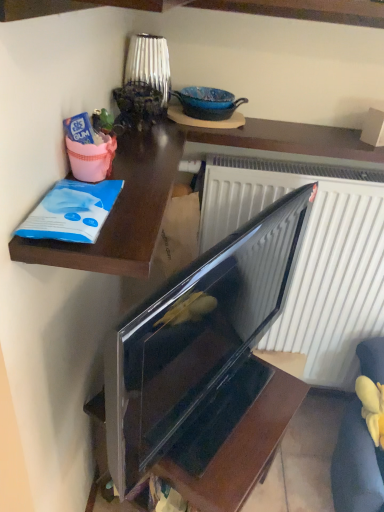
Identify the location of velvet yellow armchair at lower right. (357, 466).

The height and width of the screenshot is (512, 384). What do you see at coordinates (204, 365) in the screenshot?
I see `glossy black tv at center` at bounding box center [204, 365].

Measure the distance between point (201, 93) and camera.

Point (201, 93) and camera are 3.85 feet apart from each other.

Where is `glossy black tv at lower right`? glossy black tv at lower right is located at coordinates (242, 449).

Measure the distance between point (x=102, y=438) and camera.

Point (x=102, y=438) and camera are 1.40 meters apart from each other.

In order to click on velvet yellow armchair at lower right in this screenshot , I will do `click(357, 466)`.

Looking at this image, is blue plastic bag at upper left inside or outside of glossy black tv at center?

blue plastic bag at upper left is spatially situated outside glossy black tv at center.

Considering their positions, is blue plastic bag at upper left located in front of or behind glossy black tv at center?

In the image, blue plastic bag at upper left appears behind glossy black tv at center.

Which object is wider, blue plastic bag at upper left or glossy black tv at center?

blue plastic bag at upper left.

Is the surface of blue plastic bag at upper left in direct contact with glossy black tv at center?

No, blue plastic bag at upper left is not next to glossy black tv at center.

From the picture: Looking at their sizes, would you say glossy black tv at center is wider or thinner than blue plastic bag at upper left?

Considering their sizes, glossy black tv at center looks slimmer than blue plastic bag at upper left.

From the image's perspective, between glossy black tv at center and blue plastic bag at upper left, which one is located above?

From the image's view, blue plastic bag at upper left is above.

Are glossy black tv at center and blue plastic bag at upper left making contact?

They are not placed beside each other.

From a real-world perspective, is glossy black tv at center positioned above or below blue plastic bag at upper left?

glossy black tv at center is situated lower than blue plastic bag at upper left in the real world.

From the image's perspective, which is below, glossy black tv at lower right or blue plastic bag at upper left?

glossy black tv at lower right, from the image's perspective.

Which is less distant, (250, 469) or (51, 242)?

Point (250, 469) appears to be farther away from the viewer than point (51, 242).

Is glossy black tv at lower right inside the boundaries of blue plastic bag at upper left, or outside?

glossy black tv at lower right is located beyond the bounds of blue plastic bag at upper left.

Looking at this image, is glossy black tv at center at the back of glossy black tv at lower right?

No, glossy black tv at lower right's orientation is not away from glossy black tv at center.

Considering the relative positions of glossy black tv at lower right and glossy black tv at center in the image provided, is glossy black tv at lower right in front of glossy black tv at center?

No, glossy black tv at lower right is further to the viewer.

Can you confirm if glossy black tv at lower right is shorter than glossy black tv at center?

Yes, glossy black tv at lower right is shorter than glossy black tv at center.

Between velvet yellow armchair at lower right and shiny blue ceramic bowl at upper center, which one is positioned behind?

shiny blue ceramic bowl at upper center is behind.

From a real-world perspective, which object rests below the other?

From a 3D spatial view, velvet yellow armchair at lower right is below.

Is there a large distance between velvet yellow armchair at lower right and shiny blue ceramic bowl at upper center?

velvet yellow armchair at lower right is positioned a significant distance from shiny blue ceramic bowl at upper center.

Is velvet yellow armchair at lower right shorter than shiny blue ceramic bowl at upper center?

In fact, velvet yellow armchair at lower right may be taller than shiny blue ceramic bowl at upper center.

Is velvet yellow armchair at lower right inside the boundaries of blue plastic bag at upper left, or outside?

velvet yellow armchair at lower right lies outside blue plastic bag at upper left.

From a real-world perspective, who is located lower, velvet yellow armchair at lower right or blue plastic bag at upper left?

From a 3D spatial view, velvet yellow armchair at lower right is below.

Does velvet yellow armchair at lower right have a greater height compared to blue plastic bag at upper left?

Indeed, velvet yellow armchair at lower right has a greater height compared to blue plastic bag at upper left.

Can you confirm if velvet yellow armchair at lower right is thinner than blue plastic bag at upper left?

Correct, the width of velvet yellow armchair at lower right is less than that of blue plastic bag at upper left.

From a real-world perspective, relative to velvet yellow armchair at lower right, is shiny blue ceramic bowl at upper center vertically above or below?

shiny blue ceramic bowl at upper center is above velvet yellow armchair at lower right.

From the picture: Can you tell me how much shiny blue ceramic bowl at upper center and velvet yellow armchair at lower right differ in facing direction?

2.82 degrees.

Is shiny blue ceramic bowl at upper center aimed at velvet yellow armchair at lower right?

No.

Is point (195, 109) farther from camera compared to point (339, 488)?

No, it is not.

Locate an element on the screen. television beneath the blue plastic bag at upper left (from a real-world perspective) is located at coordinates click(x=204, y=365).

The height and width of the screenshot is (512, 384). Find the location of `desk lying behind the glossy black tv at center`. desk lying behind the glossy black tv at center is located at coordinates (121, 210).

When comparing their distances from velvet yellow armchair at lower right, does glossy black tv at lower right or shiny blue ceramic bowl at upper center seem closer?

glossy black tv at lower right is positioned closer to the anchor velvet yellow armchair at lower right.

Estimate the real-world distances between objects in this image. Which object is closer to glossy black tv at lower right, glossy black tv at center or velvet yellow armchair at lower right?

glossy black tv at center lies closer to glossy black tv at lower right than the other object.

When comparing their distances from shiny blue ceramic bowl at upper center, does glossy black tv at center or blue plastic bag at upper left seem further?

The object further to shiny blue ceramic bowl at upper center is glossy black tv at center.

When comparing their distances from glossy black tv at center, does velvet yellow armchair at lower right or shiny blue ceramic bowl at upper center seem further?

shiny blue ceramic bowl at upper center lies further to glossy black tv at center than the other object.

Looking at the image, which one is located closer to glossy black tv at center, shiny blue ceramic bowl at upper center or velvet yellow armchair at lower right?

The object closer to glossy black tv at center is velvet yellow armchair at lower right.

Estimate the real-world distances between objects in this image. Which object is closer to velvet yellow armchair at lower right, glossy black tv at lower right or blue plastic bag at upper left?

glossy black tv at lower right is closer to velvet yellow armchair at lower right.

Based on their spatial positions, is shiny blue ceramic bowl at upper center or glossy black tv at lower right further from velvet yellow armchair at lower right?

The object further to velvet yellow armchair at lower right is shiny blue ceramic bowl at upper center.

Estimate the real-world distances between objects in this image. Which object is closer to glossy black tv at center, velvet yellow armchair at lower right or glossy black tv at lower right?

glossy black tv at lower right.

The width and height of the screenshot is (384, 512). I want to click on television between shiny blue ceramic bowl at upper center and velvet yellow armchair at lower right from top to bottom, so click(x=204, y=365).

Locate an element on the screen. television situated between glossy black tv at lower right and velvet yellow armchair at lower right from left to right is located at coordinates point(204,365).

Locate an element on the screen. furniture between blue plastic bag at upper left and velvet yellow armchair at lower right in the vertical direction is located at coordinates (242, 449).

You are a GUI agent. You are given a task and a screenshot of the screen. Output one action in this format:
    pyautogui.click(x=<x>, y=<y>)
    Task: Click on the television between shiny blue ceramic bowl at upper center and glossy black tv at lower right from top to bottom
    This screenshot has width=384, height=512.
    Given the screenshot: What is the action you would take?
    pyautogui.click(x=204, y=365)